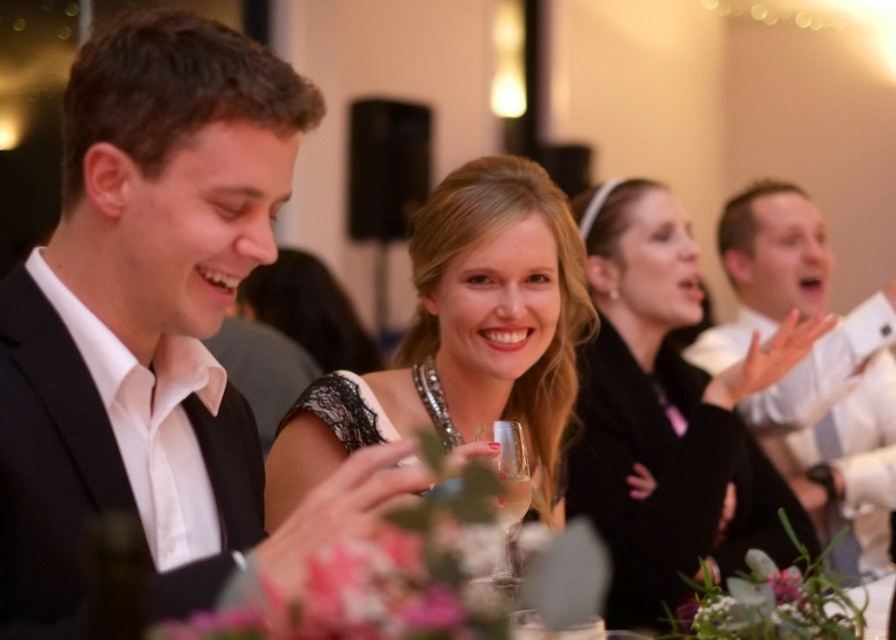
Does black satin dress at upper right appear on the left side of matte black dress at center?

No, black satin dress at upper right is not to the left of matte black dress at center.

Is point (662, 451) less distant than point (494, 387)?

No, it is not.

You are a GUI agent. You are given a task and a screenshot of the screen. Output one action in this format:
    pyautogui.click(x=<x>, y=<y>)
    Task: Click on the black satin dress at upper right
    
    Given the screenshot: What is the action you would take?
    pyautogui.click(x=668, y=413)

Is point (134, 308) positioned in front of point (578, 268)?

Yes.

What do you see at coordinates (154, 330) in the screenshot? This screenshot has height=640, width=896. I see `black satin suit at left` at bounding box center [154, 330].

Image resolution: width=896 pixels, height=640 pixels. Identify the location of black satin suit at left. (154, 330).

You are a GUI agent. You are given a task and a screenshot of the screen. Output one action in this format:
    pyautogui.click(x=<x>, y=<y>)
    Task: Click on the black satin suit at left
    The width and height of the screenshot is (896, 640).
    Given the screenshot: What is the action you would take?
    pyautogui.click(x=154, y=330)

Does point (179, 484) lie behind point (507, 572)?

No, (179, 484) is in front of (507, 572).

Is black satin suit at left to the right of clear glass wine glass at center from the viewer's perspective?

In fact, black satin suit at left is to the left of clear glass wine glass at center.

Locate an element on the screen. The width and height of the screenshot is (896, 640). black satin suit at left is located at coordinates (154, 330).